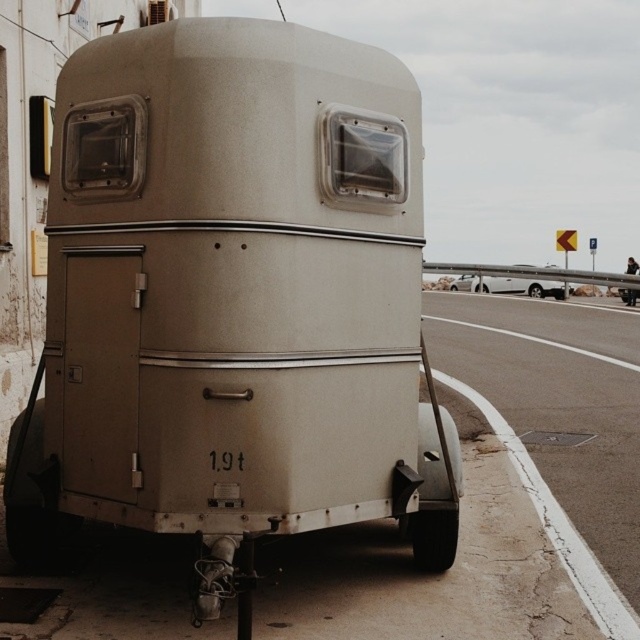
You are standing in front of the vintage horse trailer and want to know which of the two points, point (596,390) or point (468,288), is nearer to you. Can you determine this based on the trailer?

Point (596,390) is closer to the camera than point (468,288), so it is nearer to you.

Based on the photo, you are a delivery driver who needs to park your truck next to the matte white trailer at center. However, there is an asphalt road at lower right nearby. Based on the scene, which object is taller and would block your view when parking?

The asphalt road at lower right is much taller than the matte white trailer at center, so it would block your view when parking.